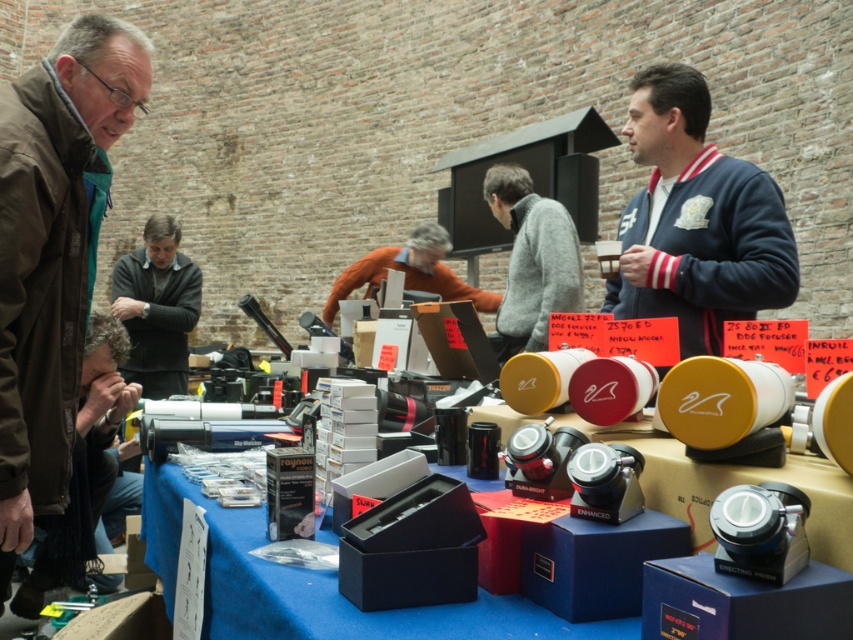
Question: Is brown leather jacket at left to the right of blue cardboard boxes at center from the viewer's perspective?

Choices:
 (A) no
 (B) yes

Answer: (A)

Question: Which of the following is the farthest from the observer?

Choices:
 (A) orange sweater at center
 (B) navy blue fleece at center
 (C) gray sweater at center
 (D) blue cardboard boxes at center

Answer: (A)

Question: Which point is closer to the camera?

Choices:
 (A) curly hair at lower left
 (B) orange sweater at center
 (C) brown leather jacket at left
 (D) blue cardboard boxes at center

Answer: (D)

Question: Considering the real-world distances, which object is closest to the orange sweater at center?

Choices:
 (A) gray sweater at center
 (B) navy blue fleece at center

Answer: (A)

Question: Is navy blue fleece at center further to camera compared to orange sweater at center?

Choices:
 (A) yes
 (B) no

Answer: (B)

Question: Is brown leather jacket at left thinner than orange sweater at center?

Choices:
 (A) no
 (B) yes

Answer: (B)